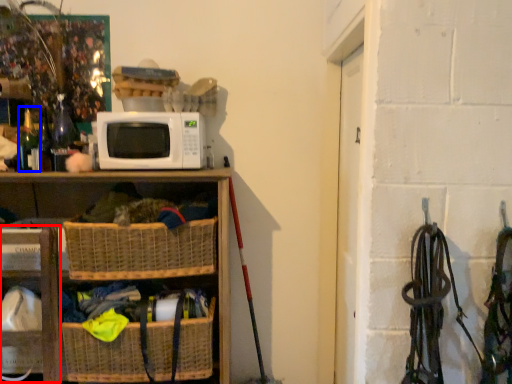
Question: Which point is closer to the camera, shelf (highlighted by a red box) or bottle (highlighted by a blue box)?

Choices:
 (A) shelf
 (B) bottle

Answer: (A)